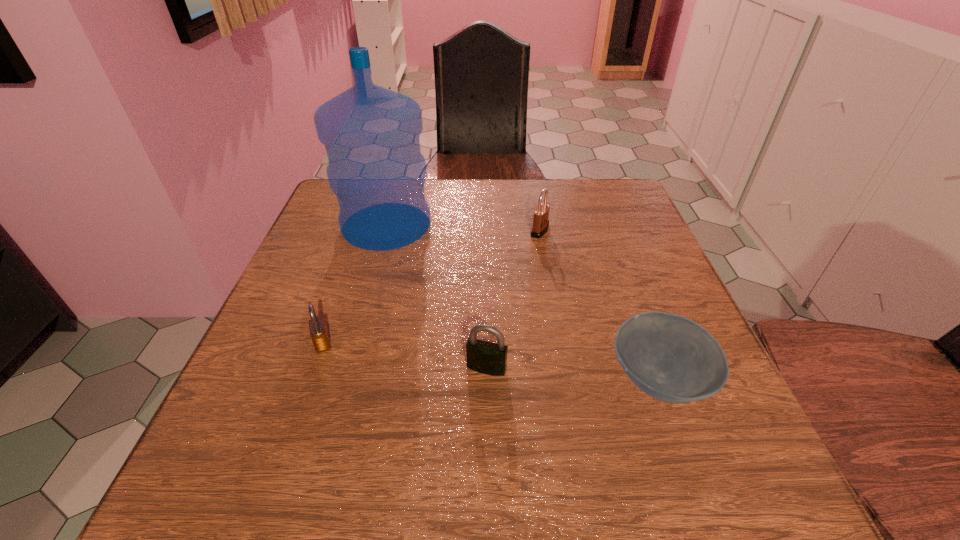
This screenshot has width=960, height=540. I want to click on free space between the second padlock from right to left and the fourth object from left to right, so (x=514, y=299).

Locate an element on the screen. free spot between the second nearest padlock and the tallest object is located at coordinates (354, 284).

Image resolution: width=960 pixels, height=540 pixels. What are the coordinates of `free area in between the nearest padlock and the water jug` in the screenshot? It's located at (437, 296).

At what (x,y) coordinates should I click in order to perform the action: click on free space between the rightmost padlock and the third object from left to right. Please return your answer as a coordinate pair (x, y). Image resolution: width=960 pixels, height=540 pixels. Looking at the image, I should click on (514, 299).

This screenshot has width=960, height=540. I want to click on free point between the leftmost padlock and the water jug, so click(354, 284).

Locate an element on the screen. object that is the closest to the shortest object is located at coordinates coord(485,357).

This screenshot has height=540, width=960. Identify the location of object that is the closest to the fourth object from left to right. (371, 134).

The height and width of the screenshot is (540, 960). What are the coordinates of `padlock identified as the third closest to the bowl` in the screenshot? It's located at (318, 331).

This screenshot has height=540, width=960. In order to click on padlock that is the nearest to the water jug in this screenshot , I will do `click(541, 214)`.

You are a GUI agent. You are given a task and a screenshot of the screen. Output one action in this format:
    pyautogui.click(x=<x>, y=<y>)
    Task: Click on the free point that satisfies the following two spatial constraints: 1. on the front side of the water jug; 2. on the right side of the rightmost object
    
    Given the screenshot: What is the action you would take?
    pyautogui.click(x=343, y=380)